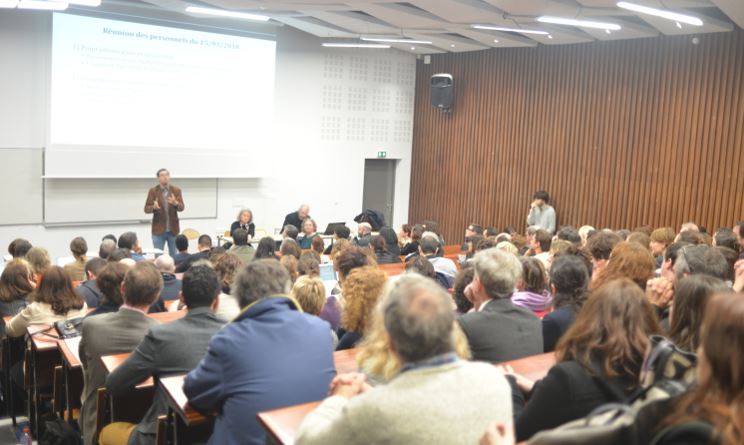
Locate an element on the screen. The height and width of the screenshot is (445, 744). projector screen is located at coordinates (155, 88).